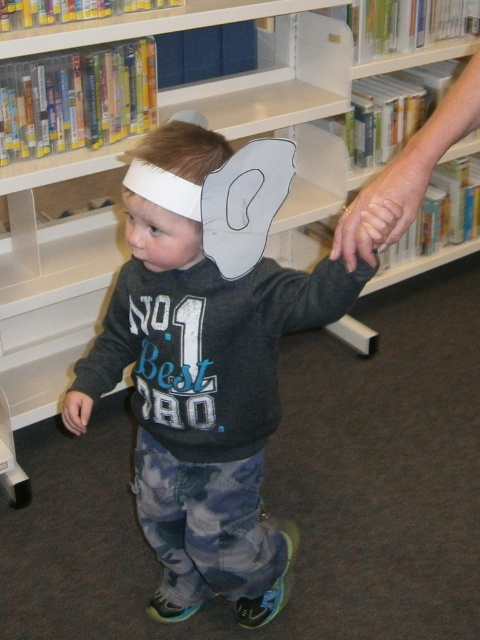
What are the coordinates of the camouflage pants at center?

The camouflage pants at center are located at point [205,362].

The child is holding hands with an adult. Considering the camouflage pants at center and the smooth skin hand at center, which one is taller?

The camouflage pants at center is much taller than the smooth skin hand at center.